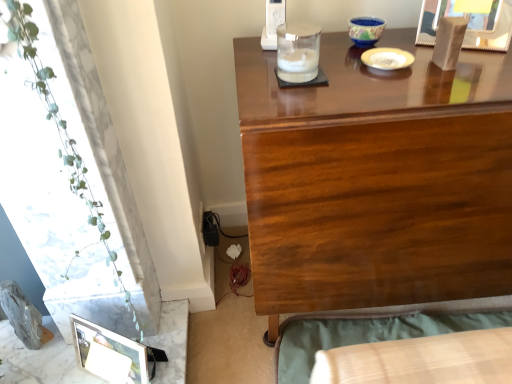
I want to click on free space between white glossy plate at upper center and clear glass candle holder at upper center, the second candle holder positioned from the back, so click(347, 64).